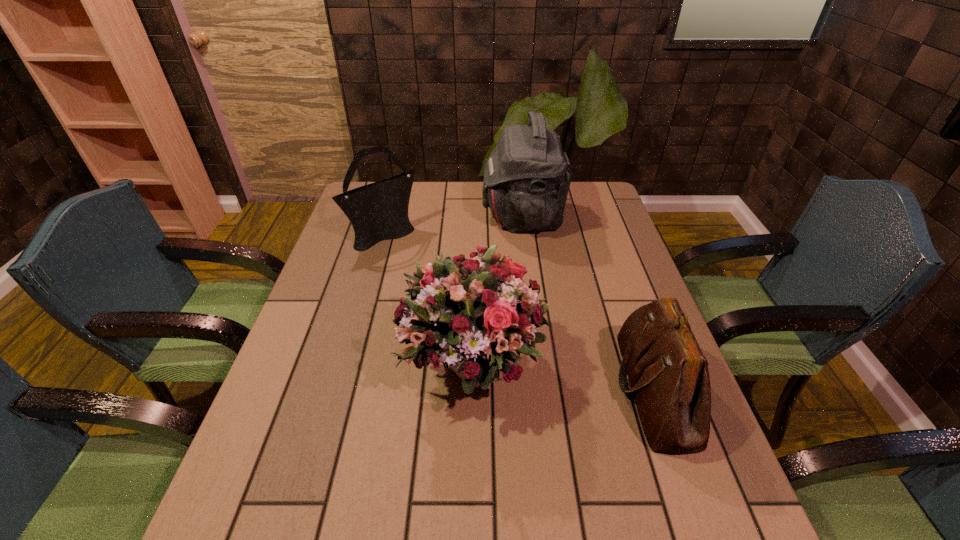
The image size is (960, 540). Identify the location of free spot located 0.190m on the left of the rightmost object. (531, 389).

Where is `object at the far edge`? object at the far edge is located at coordinates (527, 177).

You are a GUI agent. You are given a task and a screenshot of the screen. Output one action in this format:
    pyautogui.click(x=<x>, y=<y>)
    Task: Click on the object situated at the left edge
    Image resolution: width=960 pixels, height=540 pixels.
    Given the screenshot: What is the action you would take?
    point(378,211)

Image resolution: width=960 pixels, height=540 pixels. Find the location of `object that is at the right edge`. object that is at the right edge is located at coordinates (668, 374).

This screenshot has width=960, height=540. What are the coordinates of `free point at the near edge` in the screenshot? It's located at (592, 536).

In the image, there is a desktop. Identify the location of vacant space at the left edge. (312, 357).

I want to click on vacant space at the right edge, so click(643, 498).

The height and width of the screenshot is (540, 960). Identify the location of free space between the second shoulder bag from right to left and the leftmost shoulder bag. (454, 225).

Locate an element on the screen. This screenshot has width=960, height=540. free space between the leftmost shoulder bag and the second shoulder bag from left to right is located at coordinates (454, 225).

Find the location of a particular element. The height and width of the screenshot is (540, 960). free space between the second shoulder bag from right to left and the leftmost object is located at coordinates (454, 225).